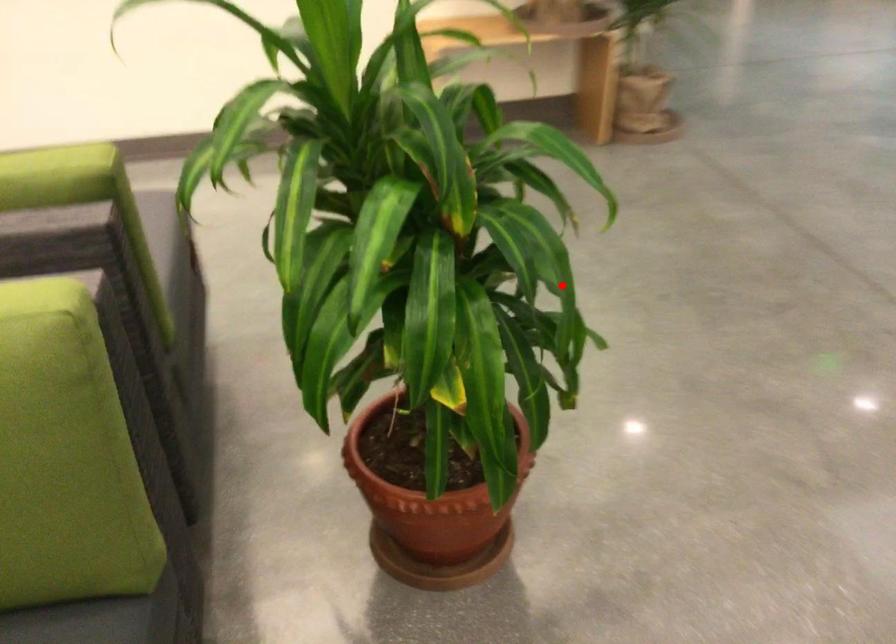
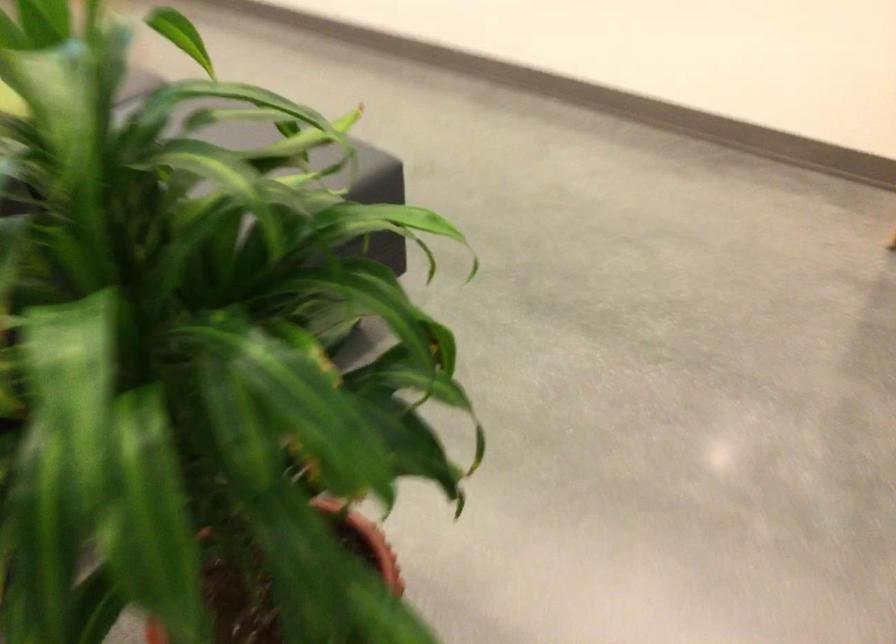
Question: I am providing you with two images of the same scene from different viewpoints. A red point is shown in image1. For the corresponding object point in image2, is it positioned nearer or farther from the camera?

Choices:
 (A) Nearer
 (B) Farther

Answer: (A)